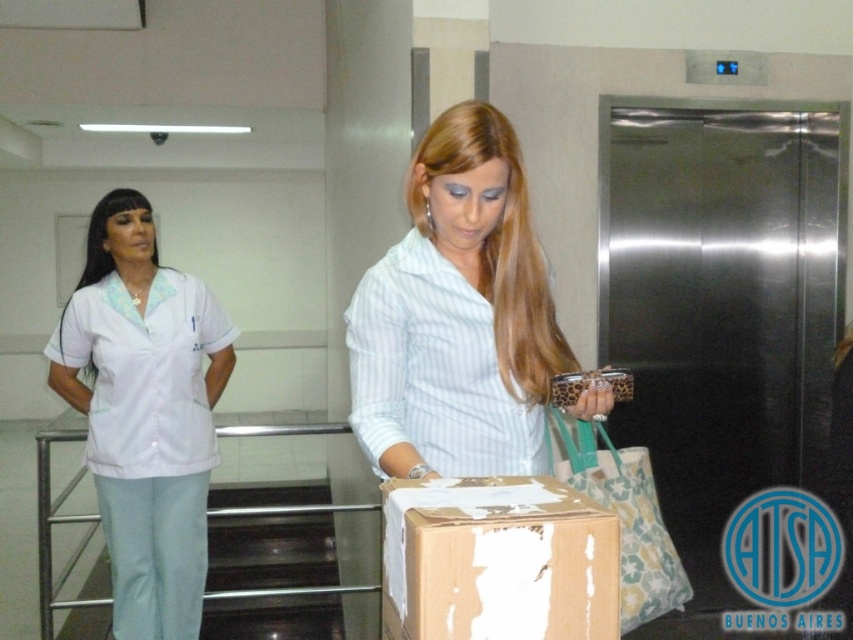
Question: Can you confirm if light blue striped shirt at center is positioned below patterned fabric shopping bag at center?

Choices:
 (A) yes
 (B) no

Answer: (B)

Question: Is white fabric uniform at left wider than patterned fabric shopping bag at center?

Choices:
 (A) no
 (B) yes

Answer: (B)

Question: Estimate the real-world distances between objects in this image. Which object is farther from the brown cardboard box at center?

Choices:
 (A) white fabric uniform at left
 (B) patterned fabric shopping bag at center
 (C) light blue striped shirt at center

Answer: (A)

Question: Which point appears closest to the camera in this image?

Choices:
 (A) (97, 428)
 (B) (515, 528)
 (C) (671, 577)

Answer: (B)

Question: Estimate the real-world distances between objects in this image. Which object is closer to the white fabric uniform at left?

Choices:
 (A) patterned fabric shopping bag at center
 (B) brown cardboard box at center

Answer: (A)

Question: Is light blue striped shirt at center below patterned fabric shopping bag at center?

Choices:
 (A) yes
 (B) no

Answer: (B)